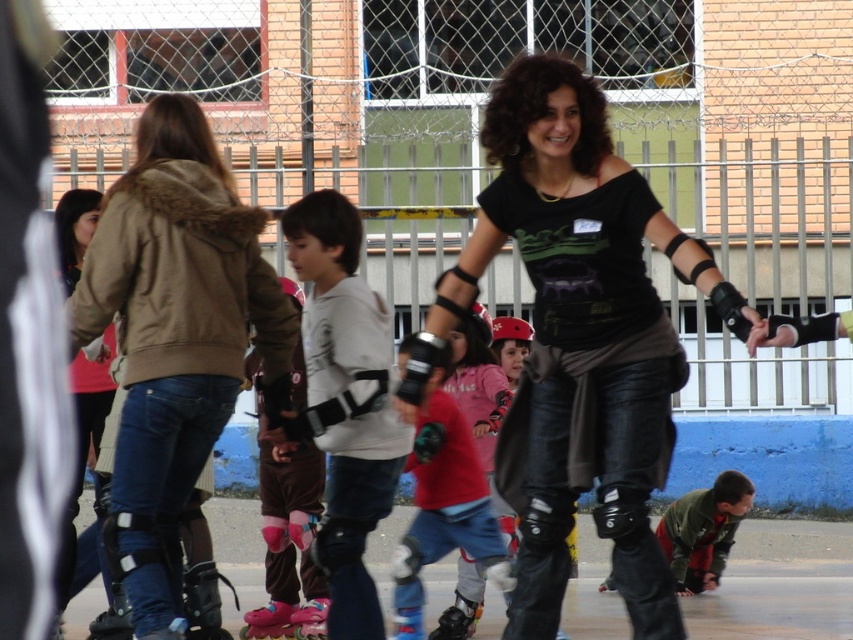
You are a safety inspector checking the setup of the roller skating area. You notice the white matte knee pads at center and the black matte roller skate at lower left. Based on their positions, which item is located higher up?

The white matte knee pads at center is above the black matte roller skate at lower left, so it is located higher up.

You are a photographer trying to capture a photo of the green fabric jacket at lower right and the matte pink roller skate at lower center. Since you want to ensure both are clearly visible, which object should you focus on first to avoid blurriness due to size differences?

The green fabric jacket at lower right is bigger than the matte pink roller skate at lower center. Therefore, you should focus on the green fabric jacket at lower right first because larger objects require more precise focusing to ensure clarity.